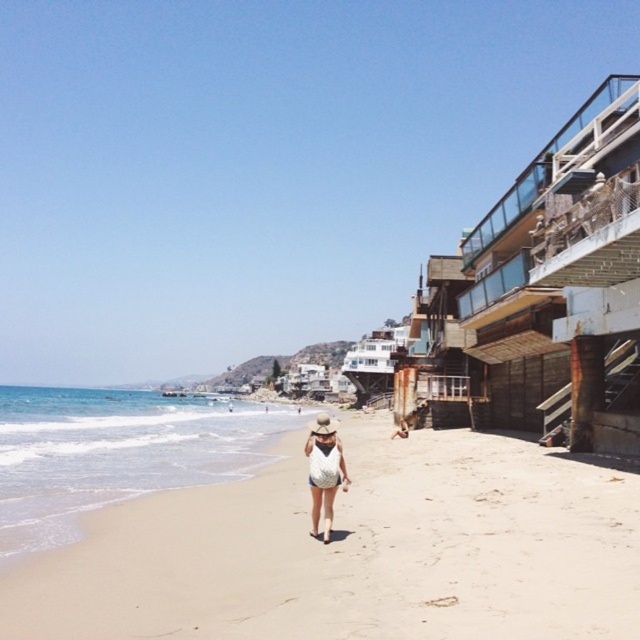
You are standing on the beige sandy beach at center and want to place the white textured dress at center so it doesn not get wet from the incoming waves. Can you determine if the dress will fit on the beach without overlapping the edges?

The beige sandy beach at center might be wider than white textured dress at center, so there is a possibility that the dress can be placed without overlapping the edges, but the exact width is uncertain.

You are standing on the beach and want to walk to both the point at coordinates point (388, 608) and the point at coordinates point (326, 513). Which point should you reach first to minimize your walking distance?

You should reach point (388, 608) first because it is closer to you than point (326, 513).